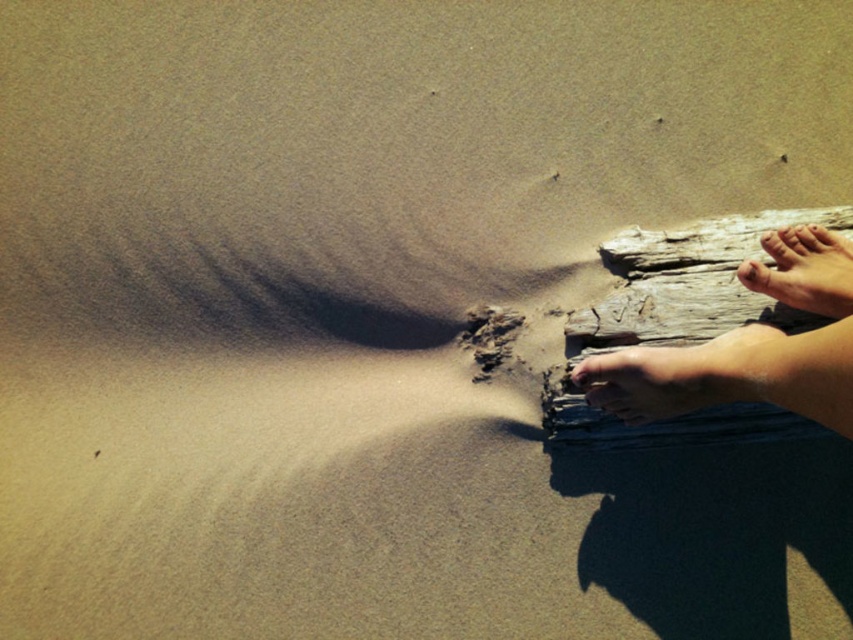
You are standing at the point with coordinates point (x=746, y=276) and want to walk towards the direction of the driftwood. Is the point point (x=624, y=385) located in front of you or behind you?

The point (x=624, y=385) is in front of point (x=746, y=276), so it is located in front of you.

You are a photographer trying to capture the shadow of the smooth skin foot at lower right and the smooth skin toe at upper right. Which object is casting a shadow that is closer to the viewer?

The smooth skin foot at lower right is positioned under the smooth skin toe at upper right, so its shadow would be closer to the viewer.